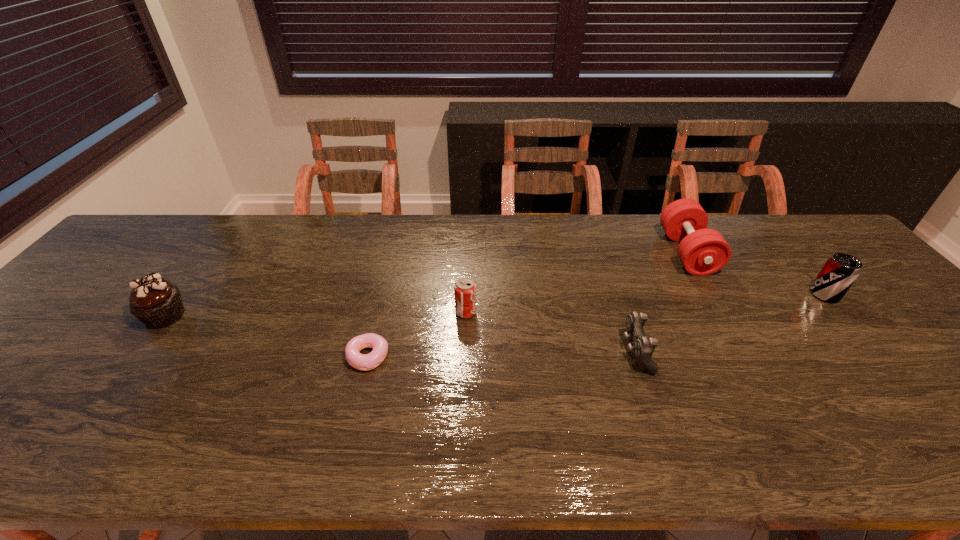
Where is `vacant space that satisfies the following two spatial constraints: 1. on the back side of the dumbbell; 2. on the left side of the cupcake`? The height and width of the screenshot is (540, 960). vacant space that satisfies the following two spatial constraints: 1. on the back side of the dumbbell; 2. on the left side of the cupcake is located at coordinates (212, 253).